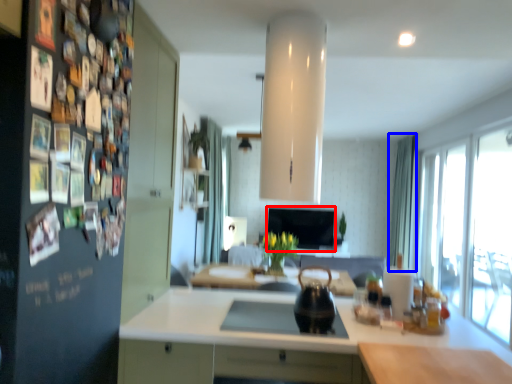
Question: Which object is further to the camera taking this photo, window screen (highlighted by a red box) or curtain (highlighted by a blue box)?

Choices:
 (A) window screen
 (B) curtain

Answer: (A)